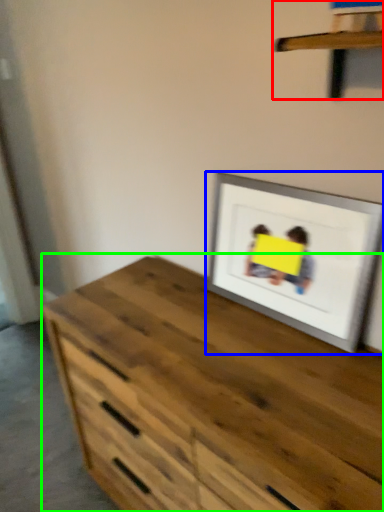
Question: Estimate the real-world distances between objects in this image. Which object is farther from shelf (highlighted by a red box), picture frame (highlighted by a blue box) or chest of drawers (highlighted by a green box)?

Choices:
 (A) picture frame
 (B) chest of drawers

Answer: (B)